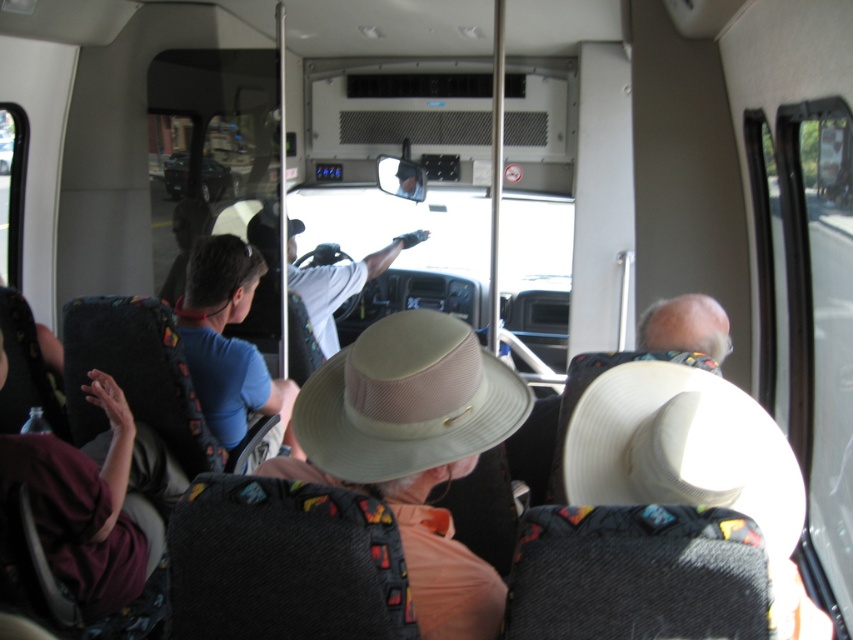
Question: Estimate the real-world distances between objects in this image. Which object is closer to the tan mesh cowboy hat at center?

Choices:
 (A) white woven cowboy hat at center
 (B) blue cotton shirt at center

Answer: (A)

Question: Estimate the real-world distances between objects in this image. Which object is farther from the beige fabric hat at center?

Choices:
 (A) tan mesh cowboy hat at center
 (B) blue cotton shirt at center

Answer: (B)

Question: Does white fabric shirt at center appear on the left side of gray fabric hat at upper center?

Choices:
 (A) yes
 (B) no

Answer: (A)

Question: Does beige fabric hat at center have a greater width compared to tan mesh cowboy hat at center?

Choices:
 (A) yes
 (B) no

Answer: (A)

Question: Considering the relative positions of beige fabric hat at center and gray fabric hat at upper center in the image provided, where is beige fabric hat at center located with respect to gray fabric hat at upper center?

Choices:
 (A) above
 (B) below

Answer: (B)

Question: Which point appears farthest from the camera in this image?

Choices:
 (A) (373, 273)
 (B) (223, 349)

Answer: (A)